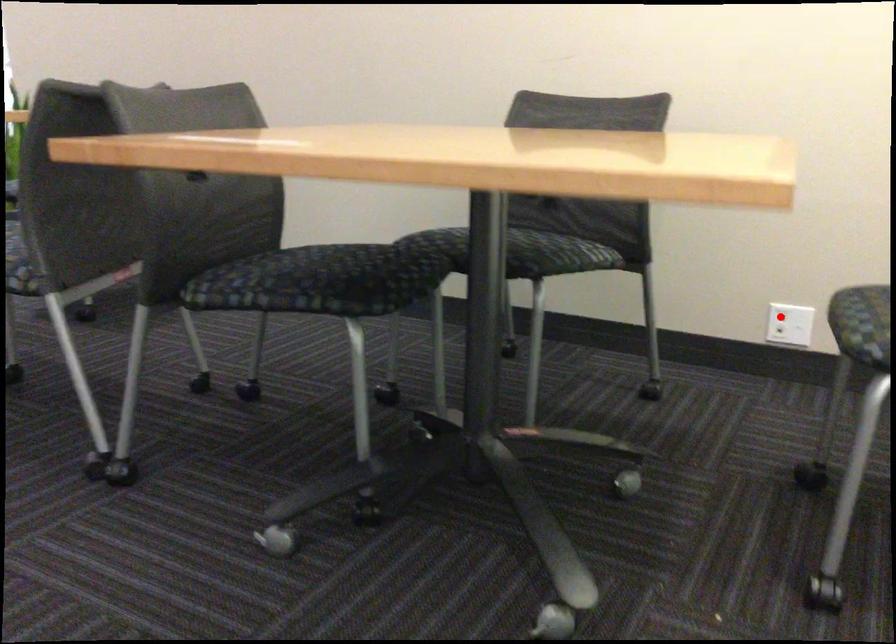
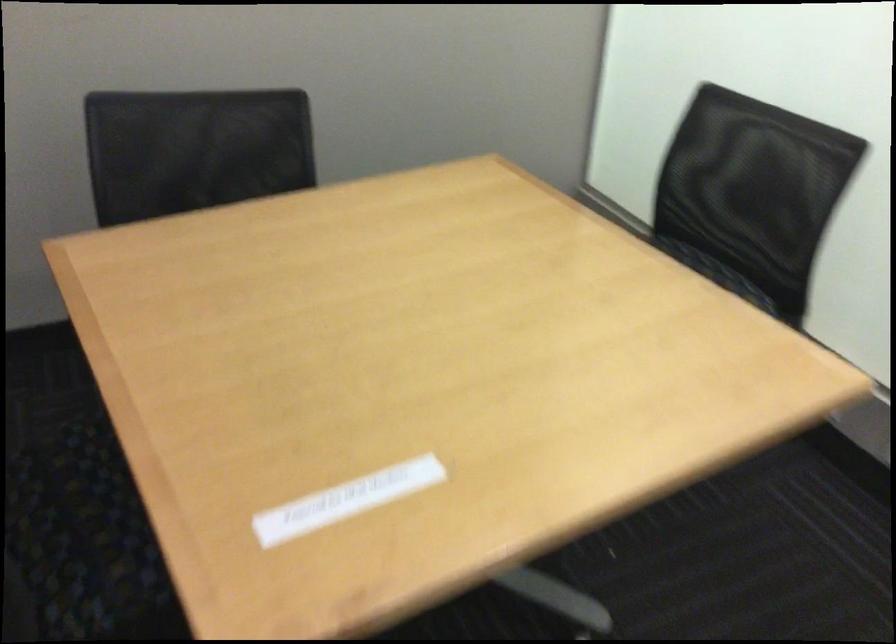
Question: I am providing you with two images of the same scene from different viewpoints. A red point is marked on the first image. Can you still see the location of the red point in image 2?

Choices:
 (A) Yes
 (B) No

Answer: (B)